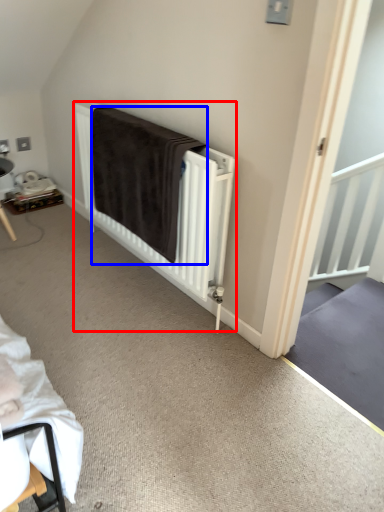
Question: Which object appears closest to the camera in this image, bed (highlighted by a red box) or blanket (highlighted by a blue box)?

Choices:
 (A) bed
 (B) blanket

Answer: (A)